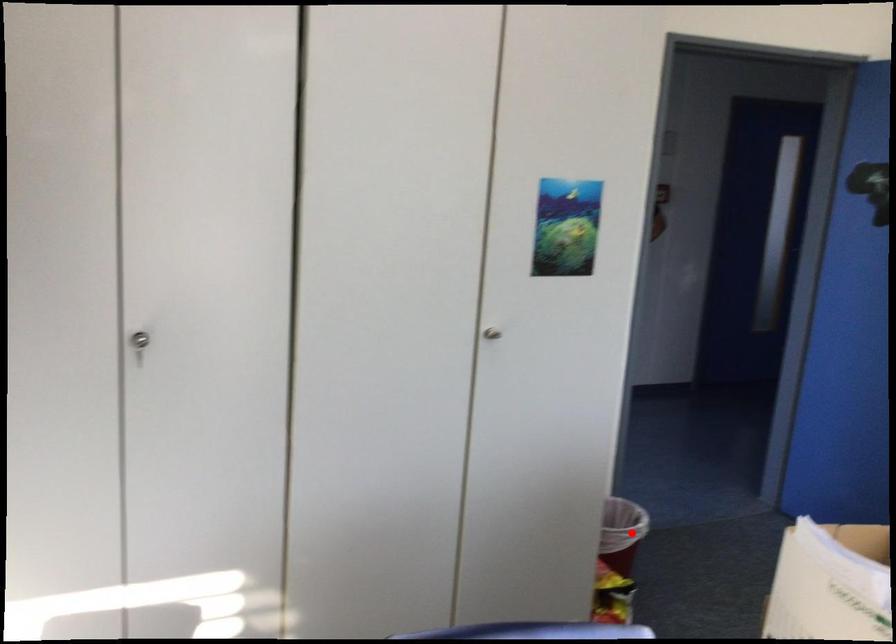
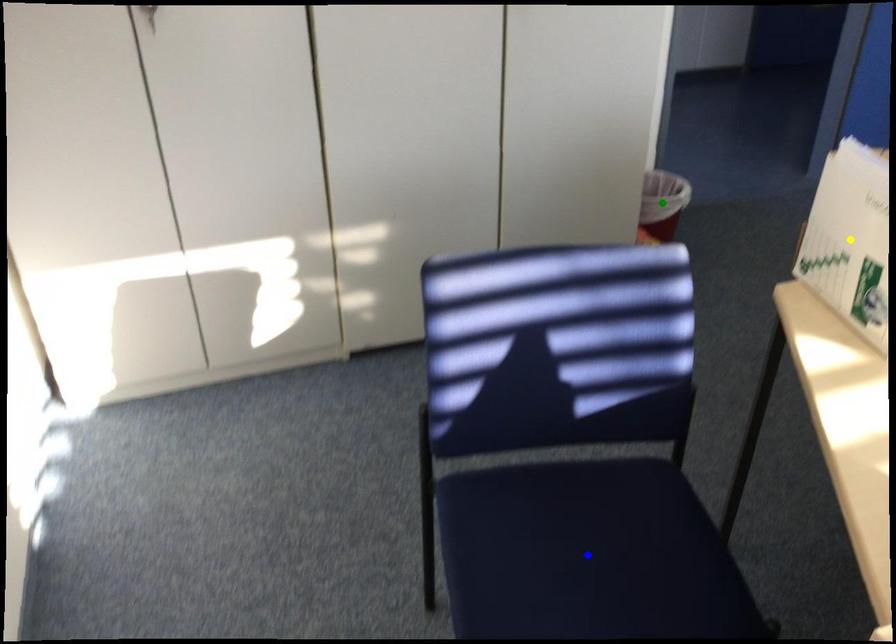
Question: I am providing you with two images of the same scene from different viewpoints. A red point is marked on the first image. You are given multiple points on the second image. Which point in image 2 is actually the same real-world point as the red point in image 1?

Choices:
 (A) green point
 (B) blue point
 (C) yellow point

Answer: (A)